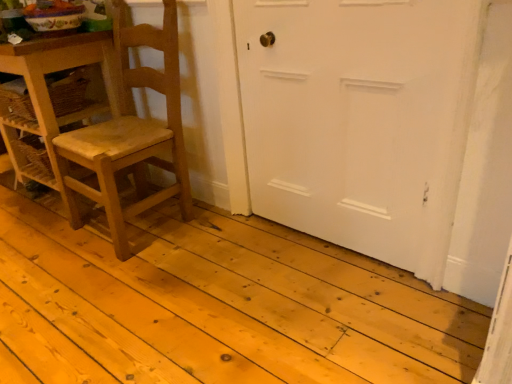
Locate an element on the screen. This screenshot has height=384, width=512. free space in front of white matte door at center is located at coordinates (330, 307).